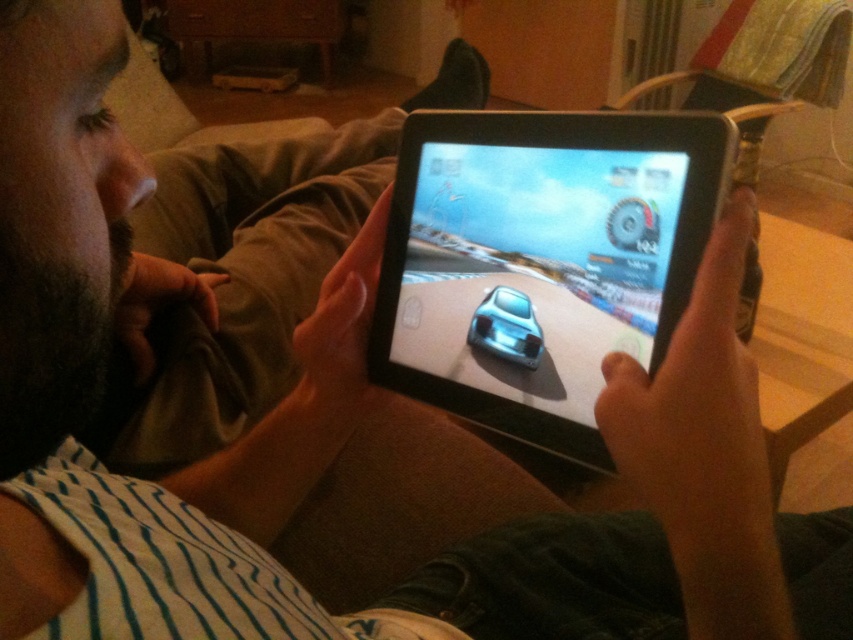
Question: Can you confirm if black glossy tablet at center is smaller than satin silver car at center?

Choices:
 (A) yes
 (B) no

Answer: (B)

Question: Is the position of black glossy tablet at center more distant than that of satin silver car at center?

Choices:
 (A) no
 (B) yes

Answer: (A)

Question: Can you confirm if black glossy tablet at center is positioned to the right of satin silver car at center?

Choices:
 (A) yes
 (B) no

Answer: (A)

Question: Among these objects, which one is farthest from the camera?

Choices:
 (A) satin silver car at center
 (B) black glossy tablet at center

Answer: (A)